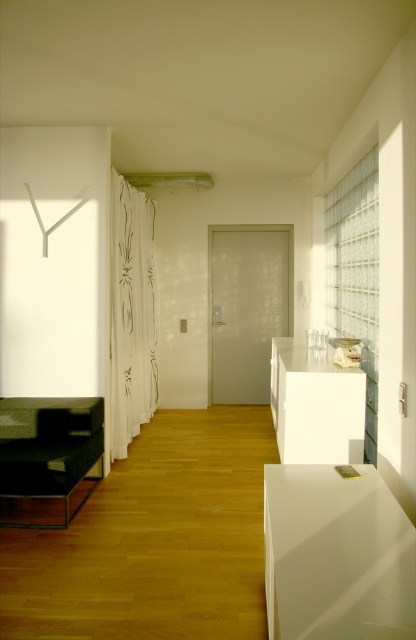
Does white glossy cabinet at center have a greater height compared to clear glass curtain at right?

Incorrect, white glossy cabinet at center's height is not larger of clear glass curtain at right's.

Locate an element on the screen. The width and height of the screenshot is (416, 640). white glossy cabinet at center is located at coordinates (316, 404).

Which is in front, point (306, 458) or point (346, 310)?

Point (306, 458) is in front.

Find the location of `white glossy cabinet at center`. white glossy cabinet at center is located at coordinates (316, 404).

Locate an element on the screen. Image resolution: width=416 pixels, height=640 pixels. white glossy cabinet at lower right is located at coordinates (336, 554).

Measure the distance from white glossy cabinet at lower right to matte black coffee table at left.

white glossy cabinet at lower right is 1.76 meters away from matte black coffee table at left.

What do you see at coordinates (336, 554) in the screenshot?
I see `white glossy cabinet at lower right` at bounding box center [336, 554].

This screenshot has height=640, width=416. I want to click on white glossy cabinet at lower right, so click(x=336, y=554).

Who is positioned more to the right, white sheer curtain at left or white glossy cabinet at center?

white glossy cabinet at center

Is point (119, 449) positioned in front of point (339, 372)?

No, it is behind (339, 372).

At what (x,y) coordinates should I click in order to perform the action: click on white sheer curtain at left. Please return your answer as a coordinate pair (x, y). Image resolution: width=416 pixels, height=640 pixels. Looking at the image, I should click on (131, 314).